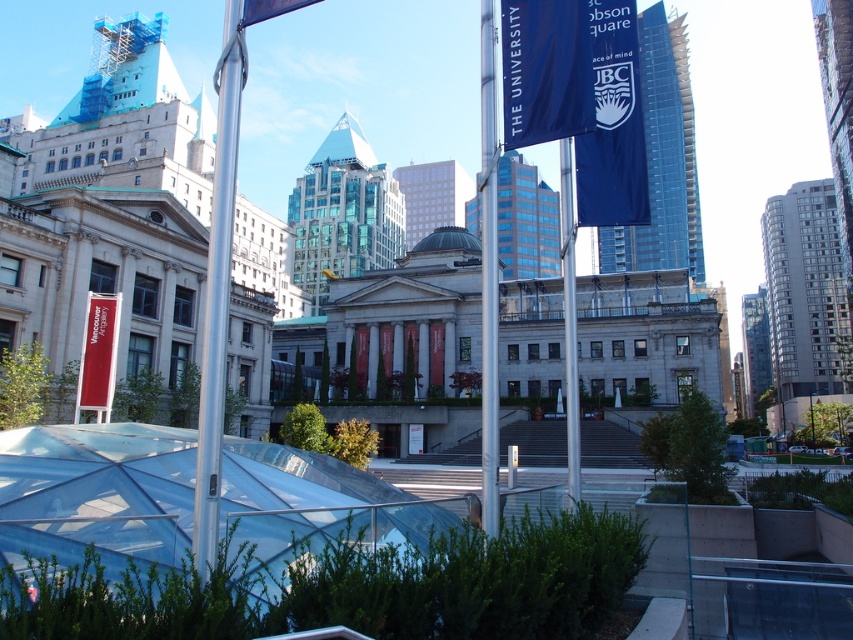
Question: Which point is closer to the camera?

Choices:
 (A) polished silver pole at center
 (B) metallic silver pole at center
 (C) blue fabric banner at upper center

Answer: (A)

Question: Which of the following is the farthest from the observer?

Choices:
 (A) (585, 68)
 (B) (572, 356)
 (C) (230, 134)

Answer: (B)

Question: Can you confirm if polished silver pole at center is positioned to the left of blue fabric flag at upper center?

Choices:
 (A) no
 (B) yes

Answer: (B)

Question: Does blue fabric flag at upper center have a smaller size compared to metallic silver pole at center?

Choices:
 (A) no
 (B) yes

Answer: (B)

Question: Which object is the farthest from the polished silver pole at center?

Choices:
 (A) blue fabric banner at upper center
 (B) blue fabric flag at upper center

Answer: (B)

Question: Is blue fabric flag at upper center wider than metallic silver pole at center?

Choices:
 (A) yes
 (B) no

Answer: (B)